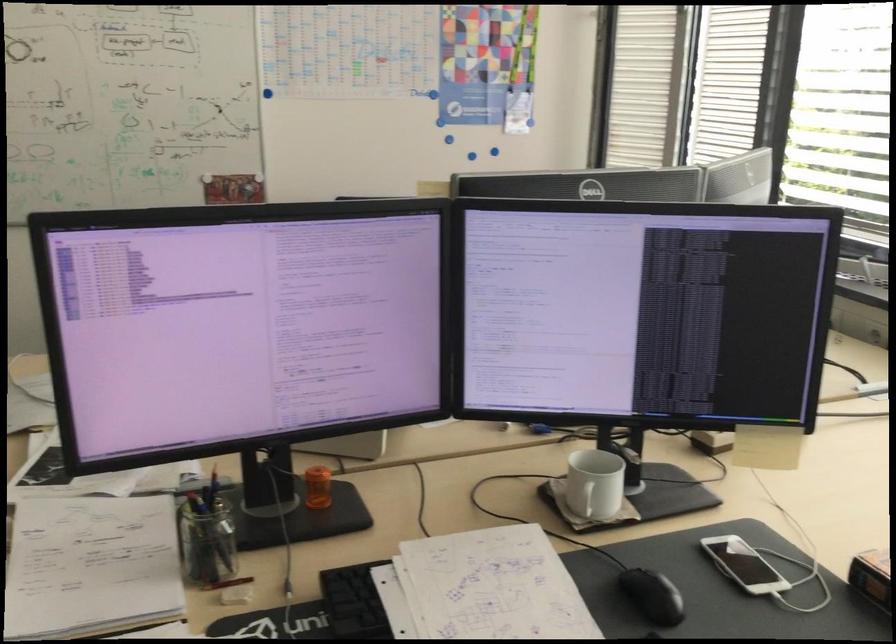
This screenshot has height=644, width=896. Identify the location of black computer mouse. click(652, 596).